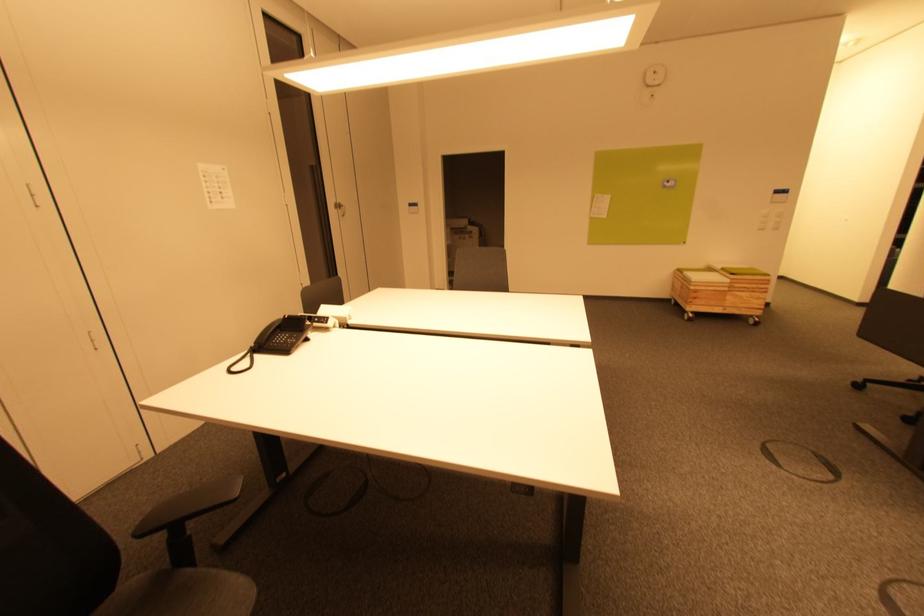
Image resolution: width=924 pixels, height=616 pixels. Find the location of `black chair armrest`. black chair armrest is located at coordinates (188, 505).